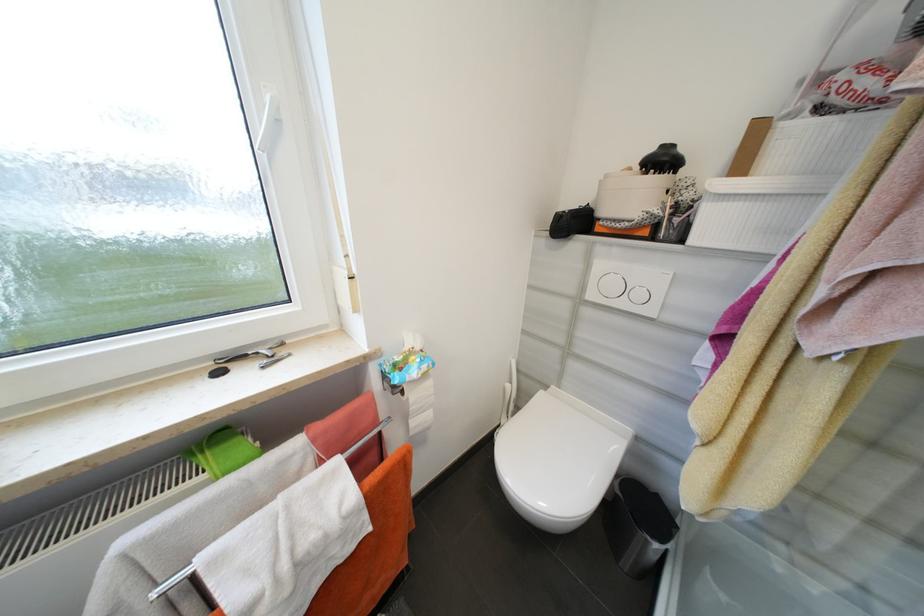
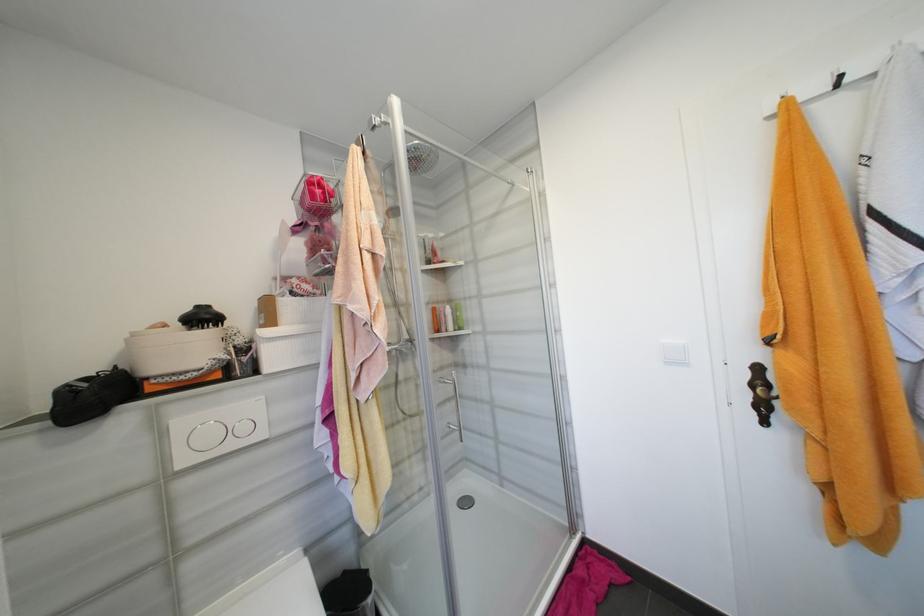
In the second image, find the point that corresponds to [663,498] in the first image.

(350, 573)